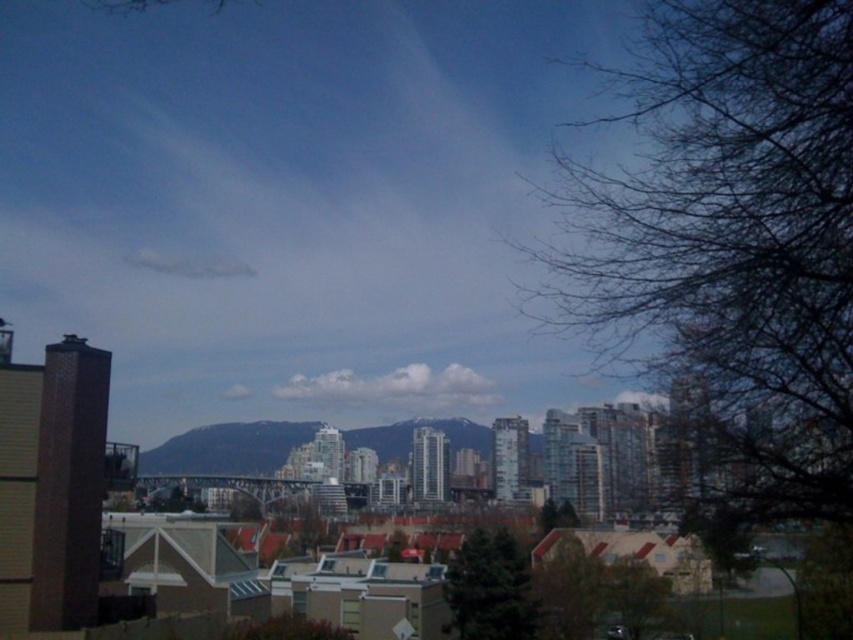
Is point (518, 611) behind point (532, 566)?

No.

Between green matte tree at center and green matte tree at lower right, which one appears on the left side from the viewer's perspective?

green matte tree at center

Does point (479, 634) lie in front of point (579, 636)?

Yes, it is.

Identify the location of green matte tree at center. (489, 588).

Between point (450, 588) and point (666, 588), which one is positioned behind?

The point (666, 588) is more distant.

Consider the image. Who is shorter, green matte tree at center or green leafy tree at lower right?

Standing shorter between the two is green leafy tree at lower right.

This screenshot has width=853, height=640. Describe the element at coordinates (489, 588) in the screenshot. I see `green matte tree at center` at that location.

Find the location of a particular element. green matte tree at center is located at coordinates (489, 588).

Is point (456, 570) positioned after point (300, 625)?

That is True.

The height and width of the screenshot is (640, 853). What do you see at coordinates (489, 588) in the screenshot?
I see `green matte tree at center` at bounding box center [489, 588].

Locate an element on the screen. green matte tree at center is located at coordinates (489, 588).